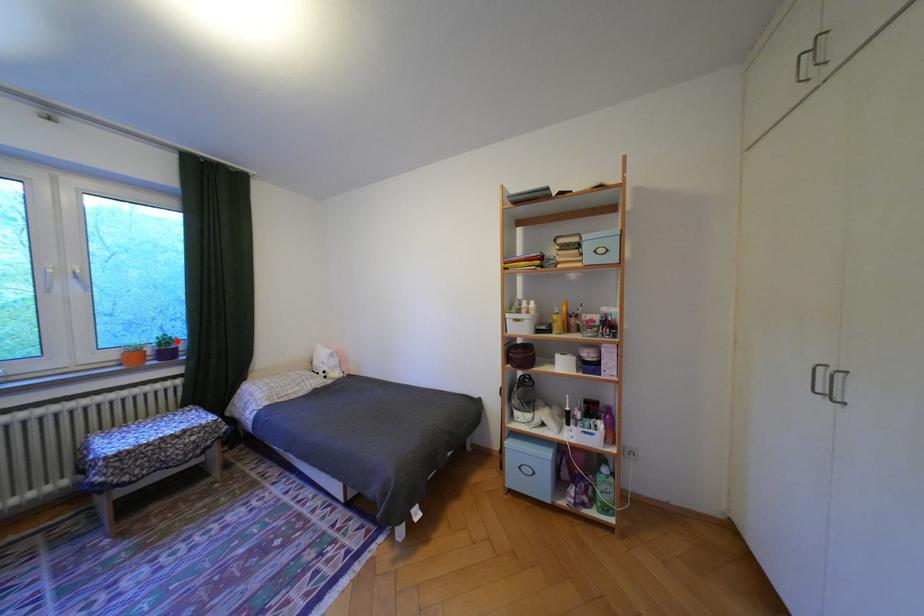
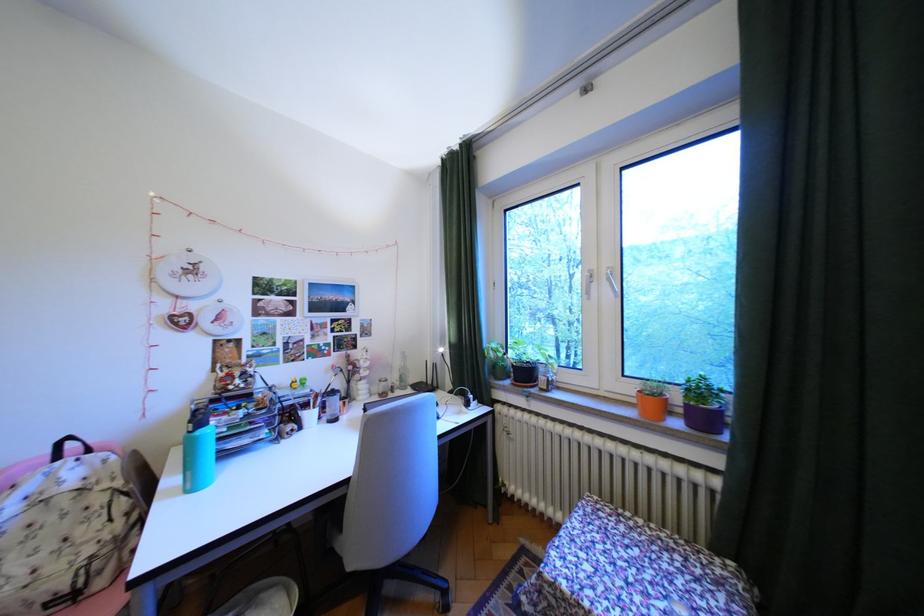
Find the pixel in the second image that matches the highlighted location in the first image.

(710, 391)